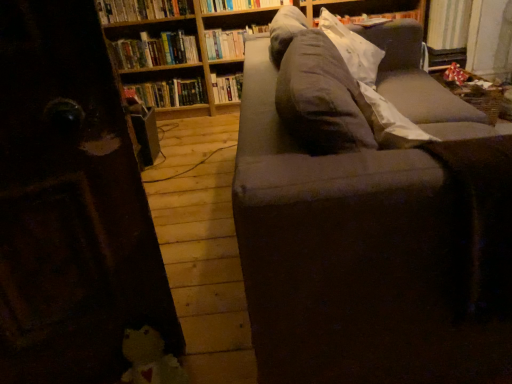
Image resolution: width=512 pixels, height=384 pixels. Describe the element at coordinates (239, 5) in the screenshot. I see `hardcover book at upper center, the first book in the top-to-bottom sequence` at that location.

The width and height of the screenshot is (512, 384). What are the coordinates of `gray fabric pillow at upper right` in the screenshot? It's located at (353, 49).

This screenshot has width=512, height=384. Describe the element at coordinates (369, 218) in the screenshot. I see `dark gray fabric couch at center` at that location.

The width and height of the screenshot is (512, 384). In order to click on hardcover book at upper left, which appears as the fourth book when viewed from the top in this screenshot , I will do `click(154, 50)`.

What do you see at coordinates (149, 359) in the screenshot? The width and height of the screenshot is (512, 384). I see `fluffy white plush at lower left` at bounding box center [149, 359].

Locate an element on the screen. The image size is (512, 384). hardcover book at upper center, positioned as the sixth book in bottom-to-top order is located at coordinates (239, 5).

In the scene shown: Which is nearer, (278, 1) or (136, 66)?

Point (278, 1)

In the image, is hardcover book at upper center, the first book in the top-to-bottom sequence, on the left side or the right side of hardcover book at upper left, which appears as the fourth book when viewed from the top?

From the image, it's evident that hardcover book at upper center, the first book in the top-to-bottom sequence, is to the right of hardcover book at upper left, which appears as the fourth book when viewed from the top.

Is hardcover book at upper center, the first book in the top-to-bottom sequence, wider or thinner than hardcover book at upper left, which appears as the fourth book when viewed from the top?

hardcover book at upper center, the first book in the top-to-bottom sequence, is thinner than hardcover book at upper left, which appears as the fourth book when viewed from the top.

From a real-world perspective, is hardcover book at upper center, positioned as the sixth book in bottom-to-top order, located beneath hardcover book at upper left, the third book positioned from the bottom?

No, from a real-world perspective, hardcover book at upper center, positioned as the sixth book in bottom-to-top order, is not below hardcover book at upper left, the third book positioned from the bottom.

Is hardcover book at center, positioned as the first book in bottom-to-top order, bigger than hardcover book at upper center, the first book in the top-to-bottom sequence?

Correct, hardcover book at center, positioned as the first book in bottom-to-top order, is larger in size than hardcover book at upper center, the first book in the top-to-bottom sequence.

Based on the photo, which object is positioned more to the right, hardcover book at center, arranged as the sixth book when viewed from the top, or hardcover book at upper center, the first book in the top-to-bottom sequence?

hardcover book at upper center, the first book in the top-to-bottom sequence.

Can we say hardcover book at center, arranged as the sixth book when viewed from the top, lies outside hardcover book at upper center, positioned as the sixth book in bottom-to-top order?

Yes, hardcover book at center, arranged as the sixth book when viewed from the top, is not within hardcover book at upper center, positioned as the sixth book in bottom-to-top order.

Is hardcover books at upper left, the 5th book ordered from the bottom, shorter than hardcover book at upper left, the third book positioned from the bottom?

Yes.

Would you say hardcover books at upper left, the 5th book ordered from the bottom, is to the left or to the right of hardcover book at upper left, the third book positioned from the bottom, in the picture?

Based on their positions, hardcover books at upper left, the 5th book ordered from the bottom, is located to the left of hardcover book at upper left, the third book positioned from the bottom.

From the image's perspective, between hardcover books at upper left, the 5th book ordered from the bottom, and hardcover book at upper left, which appears as the fourth book when viewed from the top, which one is located above?

hardcover books at upper left, the 5th book ordered from the bottom, is shown above in the image.

Which of these two, hardcover books at upper left, the 5th book ordered from the bottom, or hardcover book at upper left, the third book positioned from the bottom, is bigger?

Bigger between the two is hardcover book at upper left, the third book positioned from the bottom.

Looking at this image, would you say fluffy white plush at lower left is outside wooden bookcase at upper center?

That's correct, fluffy white plush at lower left is outside of wooden bookcase at upper center.

Can you confirm if fluffy white plush at lower left is thinner than wooden bookcase at upper center?

Correct, the width of fluffy white plush at lower left is less than that of wooden bookcase at upper center.

Is fluffy white plush at lower left with wooden bookcase at upper center?

No, fluffy white plush at lower left is not next to wooden bookcase at upper center.

Based on their sizes in the image, would you say hardcover book at center, positioned as the first book in bottom-to-top order, is bigger or smaller than gray fabric pillow at upper right?

Considering their sizes, hardcover book at center, positioned as the first book in bottom-to-top order, takes up less space than gray fabric pillow at upper right.

Which of these two, hardcover book at center, arranged as the sixth book when viewed from the top, or gray fabric pillow at upper right, stands taller?

gray fabric pillow at upper right.

Consider the image. Is hardcover book at center, positioned as the first book in bottom-to-top order, not close to gray fabric pillow at upper right?

Yes, hardcover book at center, positioned as the first book in bottom-to-top order, and gray fabric pillow at upper right are quite far apart.

From a real-world perspective, which object rests below the other?

In real-world perspective, hardcover book at center, arranged as the sixth book when viewed from the top, is lower.

Which object is further away from the camera, hardcover book at upper center, which is the 5th book from top to bottom, or hardcover book at upper center, positioned as the sixth book in bottom-to-top order?

hardcover book at upper center, which is the 5th book from top to bottom, is further away from the camera.

From a real-world perspective, is hardcover book at upper center, the second book when ordered from bottom to top, above or below hardcover book at upper center, the first book in the top-to-bottom sequence?

hardcover book at upper center, the second book when ordered from bottom to top, is situated lower than hardcover book at upper center, the first book in the top-to-bottom sequence, in the real world.

From the image's perspective, is hardcover book at upper center, the second book when ordered from bottom to top, on hardcover book at upper center, positioned as the sixth book in bottom-to-top order?

No, from the image's perspective, hardcover book at upper center, the second book when ordered from bottom to top, is not on top of hardcover book at upper center, positioned as the sixth book in bottom-to-top order.

In the scene shown: Does hardcover book at upper center, positioned as the sixth book in bottom-to-top order, have a lesser width compared to hardcover book at upper center, the second book when ordered from bottom to top?

Yes, hardcover book at upper center, positioned as the sixth book in bottom-to-top order, is thinner than hardcover book at upper center, the second book when ordered from bottom to top.

How many degrees apart are the facing directions of hardcover book at upper center, positioned as the sixth book in bottom-to-top order, and hardcover book at upper center, the second book when ordered from bottom to top?

The angular difference between hardcover book at upper center, positioned as the sixth book in bottom-to-top order, and hardcover book at upper center, the second book when ordered from bottom to top, is 0.000663 degrees.

Consider the image. Considering the positions of objects hardcover book at upper center, the first book in the top-to-bottom sequence, and hardcover book at upper center, which is the 5th book from top to bottom, in the image provided, who is more to the right, hardcover book at upper center, the first book in the top-to-bottom sequence, or hardcover book at upper center, which is the 5th book from top to bottom,?

From the viewer's perspective, hardcover book at upper center, the first book in the top-to-bottom sequence, appears more on the right side.

Is hardcover book at upper center, the first book in the top-to-bottom sequence, taller than hardcover book at upper center, which is the 5th book from top to bottom?

In fact, hardcover book at upper center, the first book in the top-to-bottom sequence, may be shorter than hardcover book at upper center, which is the 5th book from top to bottom.

Where is `the 4th book counting from the right side of the hardcover book at upper left, the third book positioned from the bottom`? the 4th book counting from the right side of the hardcover book at upper left, the third book positioned from the bottom is located at coordinates (239, 5).

Locate an element on the screen. Image resolution: width=512 pixels, height=384 pixels. the 4th book positioned above the hardcover book at center, arranged as the sixth book when viewed from the top (from a real-world perspective) is located at coordinates (239, 5).

Looking at the image, which one is located closer to hardcover books at upper left, the 5th book ordered from the bottom, dark gray fabric couch at center or hardcover book at upper center, the third book when ordered from top to bottom?

The object closer to hardcover books at upper left, the 5th book ordered from the bottom, is hardcover book at upper center, the third book when ordered from top to bottom.

When comparing their distances from fluffy white plush at lower left, does hardcover book at center, arranged as the sixth book when viewed from the top, or gray fabric pillow at upper right seem closer?

gray fabric pillow at upper right is positioned closer to the anchor fluffy white plush at lower left.

Based on their spatial positions, is hardcover book at upper left, the third book positioned from the bottom, or wooden bookcase at upper center further from hardcover book at upper center, the second book when ordered from bottom to top?

hardcover book at upper left, the third book positioned from the bottom, is positioned further to the anchor hardcover book at upper center, the second book when ordered from bottom to top.

Estimate the real-world distances between objects in this image. Which object is closer to hardcover book at upper center, the third book when ordered from top to bottom, wooden bookcase at upper center or hardcover book at upper center, which is the 5th book from top to bottom?

Among the two, hardcover book at upper center, which is the 5th book from top to bottom, is located nearer to hardcover book at upper center, the third book when ordered from top to bottom.

From the image, which object appears to be nearer to hardcover book at upper center, the second book when ordered from bottom to top, hardcover book at upper left, which appears as the fourth book when viewed from the top, or fluffy white plush at lower left?

hardcover book at upper left, which appears as the fourth book when viewed from the top, is positioned closer to the anchor hardcover book at upper center, the second book when ordered from bottom to top.

Based on their spatial positions, is hardcover book at upper left, the third book positioned from the bottom, or wooden bookcase at upper center closer to hardcover book at upper center, positioned as the sixth book in bottom-to-top order?

wooden bookcase at upper center is closer to hardcover book at upper center, positioned as the sixth book in bottom-to-top order.

In the scene shown: Looking at the image, which one is located further to wooden bookcase at upper center, hardcover book at upper center, positioned as the sixth book in bottom-to-top order, or fluffy white plush at lower left?

fluffy white plush at lower left is further to wooden bookcase at upper center.

From the image, which object appears to be nearer to hardcover book at center, positioned as the first book in bottom-to-top order, fluffy white plush at lower left or hardcover book at upper left, which appears as the fourth book when viewed from the top?

hardcover book at upper left, which appears as the fourth book when viewed from the top, lies closer to hardcover book at center, positioned as the first book in bottom-to-top order, than the other object.

Where is `bookcase between hardcover books at upper left, the 5th book ordered from the bottom, and gray fabric pillow at upper right from left to right`? bookcase between hardcover books at upper left, the 5th book ordered from the bottom, and gray fabric pillow at upper right from left to right is located at coordinates click(177, 59).

At what (x,y) coordinates should I click in order to perform the action: click on toy between dark gray fabric couch at center and hardcover books at upper left, the second book from the top, along the z-axis. Please return your answer as a coordinate pair (x, y). The height and width of the screenshot is (384, 512). Looking at the image, I should click on (149, 359).

Locate an element on the screen. Image resolution: width=512 pixels, height=384 pixels. toy between dark gray fabric couch at center and hardcover book at upper center, positioned as the sixth book in bottom-to-top order, in the front-back direction is located at coordinates [x=149, y=359].

This screenshot has height=384, width=512. I want to click on bookcase positioned between fluffy white plush at lower left and hardcover book at upper center, the 4th book in the bottom-to-top sequence, from near to far, so click(177, 59).